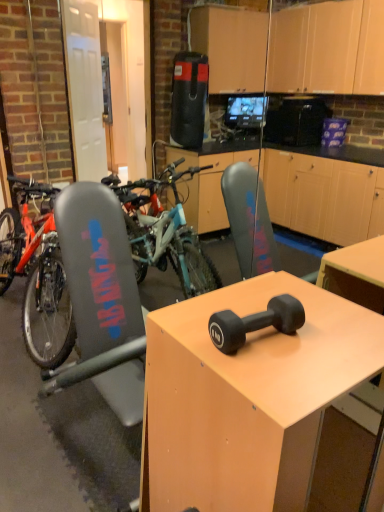
The image size is (384, 512). What are the coordinates of `free space to the right of black rubber dumbbell at center` in the screenshot? It's located at (328, 344).